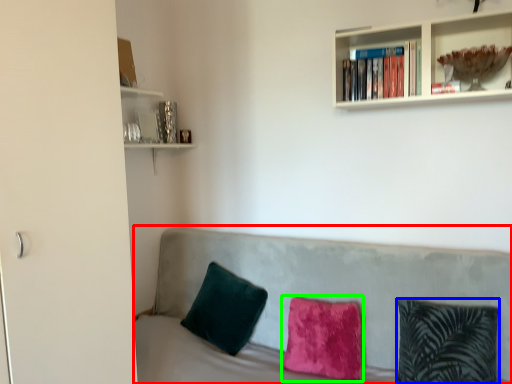
Question: Which is nearer to the studio couch (highlighted by a red box)? pillow (highlighted by a blue box) or pillow (highlighted by a green box).

Choices:
 (A) pillow
 (B) pillow

Answer: (B)